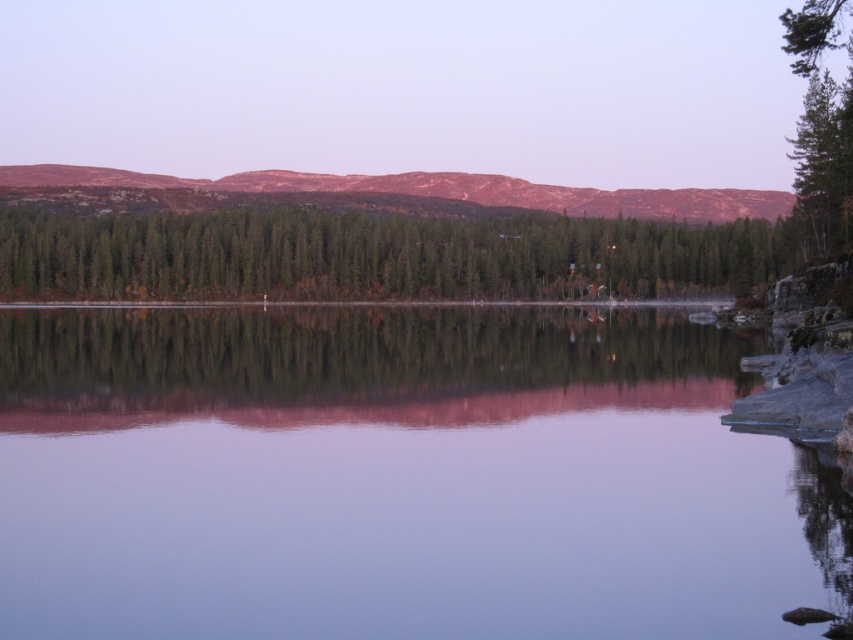
Question: Which point is farther to the camera?

Choices:
 (A) tap(820, 214)
 (B) tap(241, 449)
 (C) tap(628, 189)

Answer: (C)

Question: Which point is farther from the camera taking this photo?

Choices:
 (A) (833, 22)
 (B) (247, 464)
 (C) (550, 209)

Answer: (C)

Question: Can you confirm if transparent water at center is wider than rustic brown mountain at upper center?

Choices:
 (A) no
 (B) yes

Answer: (A)

Question: Does green matte trees at center appear on the right side of rustic brown mountain at upper center?

Choices:
 (A) yes
 (B) no

Answer: (A)

Question: Is rustic brown mountain at upper center positioned behind green textured tree at right?

Choices:
 (A) no
 (B) yes

Answer: (B)

Question: Which point is farther from the camera taking this photo?

Choices:
 (A) (683, 445)
 (B) (827, 250)
 (C) (752, 272)

Answer: (C)